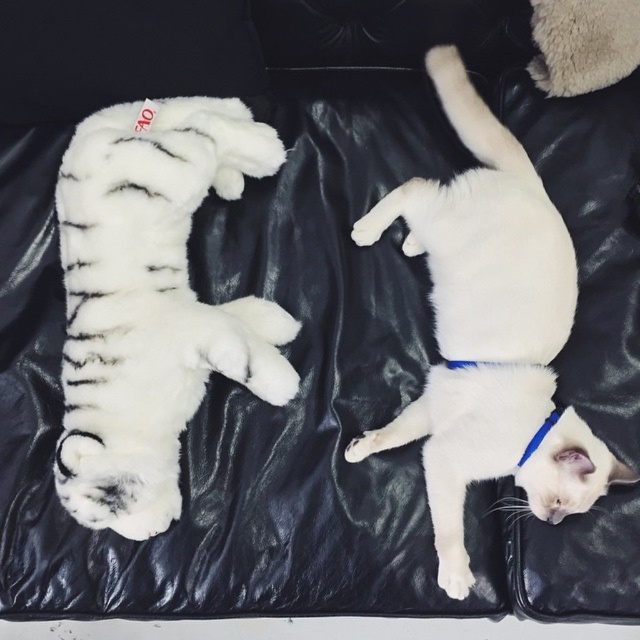
You are a cat owner who wants to place a new toy for your cats. The white plush toy at left is already present. You have a new toy that is the same size as the blue fabric neckband at lower right. Where should you place the new toy so that it doesn

The white plush toy at left is larger in size than the blue fabric neckband at lower right. Since the new toy is the same size as the blue fabric neckband at lower right, it would be appropriately placed near the blue fabric neckband at lower right to maintain a proportional arrangement.

You are a cat owner who wants to place a new toy for your pets. You have a white plush toy at left and a blue fabric neckband at lower right. Which object is positioned higher up in the image?

The white plush toy at left is located above the blue fabric neckband at lower right in the image.